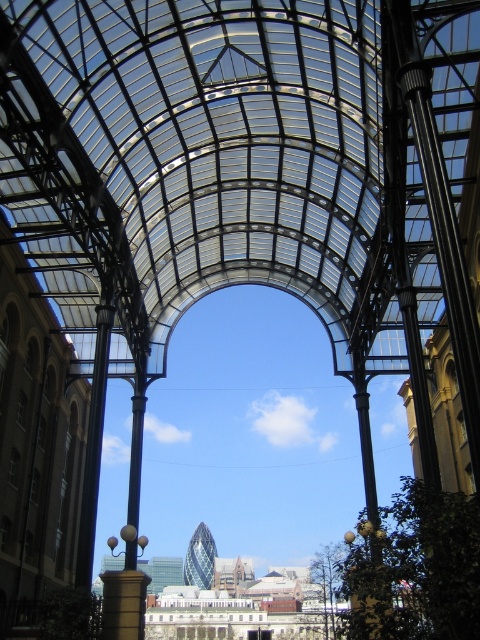
Is transparent glass roof at center taller than metallic pole at center?

Correct, transparent glass roof at center is much taller as metallic pole at center.

Who is more distant from viewer, (147, 188) or (144, 593)?

Point (147, 188)

You are a GUI agent. You are given a task and a screenshot of the screen. Output one action in this format:
    pyautogui.click(x=<x>, y=<y>)
    Task: Click on the transparent glass roof at center
    
    Given the screenshot: What is the action you would take?
    pyautogui.click(x=202, y=163)